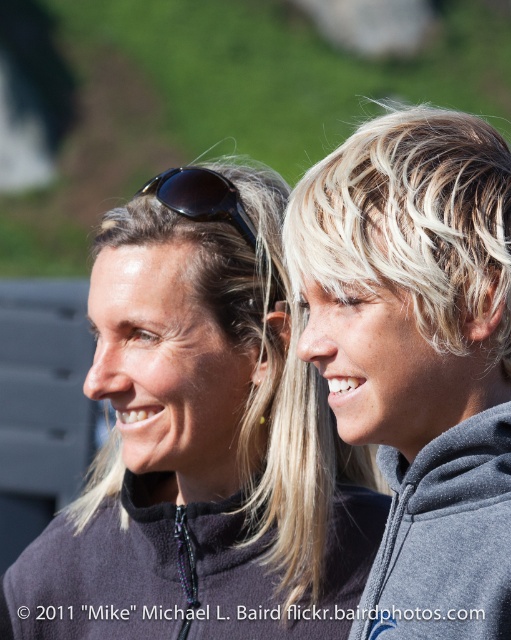
You are a photographer trying to capture a clear shot of the black plastic sunglasses at upper center. However, the gray fleece sweatshirt at right is blocking your view. Can you move around to the left side of the scene to get an unobstructed view of the sunglasses?

The gray fleece sweatshirt at right is in front of the black plastic sunglasses at upper center, so moving to the left side of the scene would allow you to see around the sweatshirt and get an unobstructed view of the sunglasses.

You are trying to decide which dark gray fleece item to wear for a walk in the park. Both the dark gray fleece at center and the dark gray fleece sweatshirt at center are available. Which one is larger?

The dark gray fleece at center is bigger than the dark gray fleece sweatshirt at center, so you should choose the dark gray fleece at center if you want a larger item.

You are a photographer trying to capture a clear shot of the dark gray fleece at center and the dark gray fleece sweatshirt at center. Since both items are at the center, which one is more visible in the photo?

The dark gray fleece at center is positioned over dark gray fleece sweatshirt at center, so it is more visible in the photo.